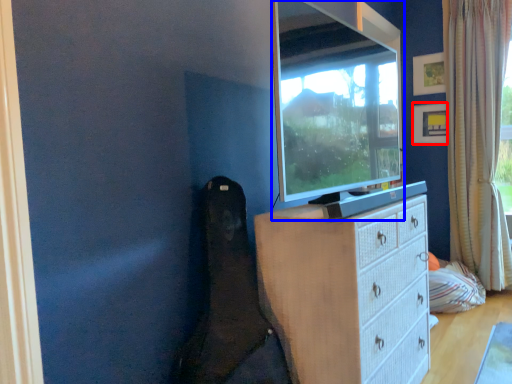
Question: Among these objects, which one is nearest to the camera, picture frame (highlighted by a red box) or television (highlighted by a blue box)?

Choices:
 (A) picture frame
 (B) television

Answer: (B)